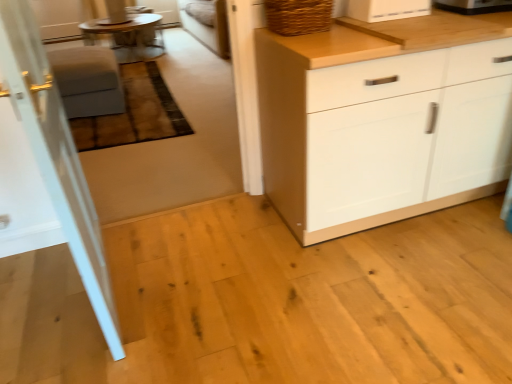
Locate an element on the screen. The width and height of the screenshot is (512, 384). vacant area that is in front of white glossy toaster at upper center, placed as the 1th appliance when sorted from left to right is located at coordinates (410, 18).